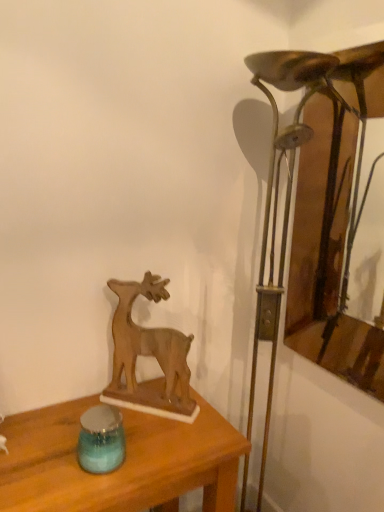
At what (x,y) coordinates should I click in order to perform the action: click on free point behind blue glass candle holder at lower left. Please return your answer as a coordinate pair (x, y). Looking at the image, I should click on (123, 416).